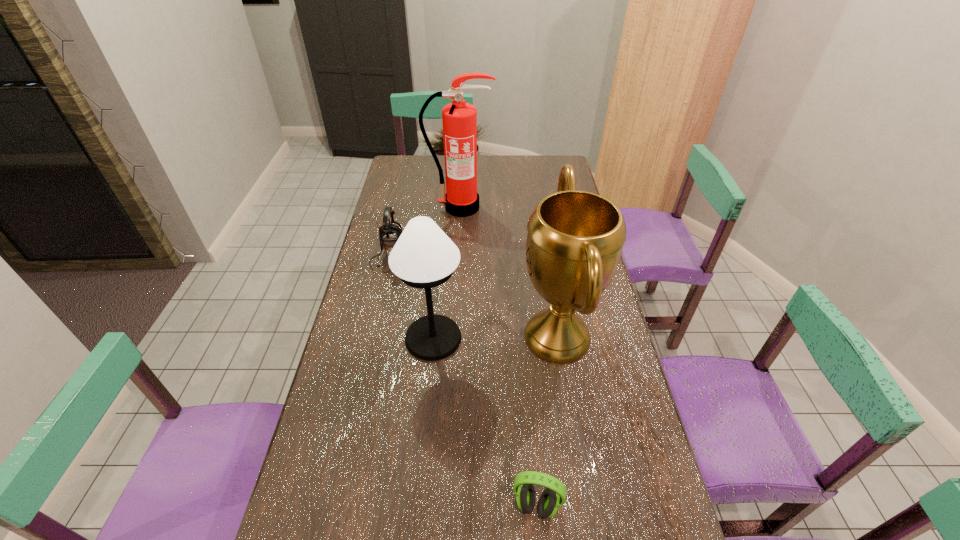
I want to click on free region at the far right corner, so click(552, 156).

At what (x,y) coordinates should I click in order to perform the action: click on vacant point located between the nearest object and the trophy cup. Please return your answer as a coordinate pair (x, y). Looking at the image, I should click on (546, 421).

At what (x,y) coordinates should I click in order to perform the action: click on free space between the fire extinguisher and the headset. Please return your answer as a coordinate pair (x, y). Image resolution: width=960 pixels, height=540 pixels. Looking at the image, I should click on (498, 356).

Locate an element on the screen. The height and width of the screenshot is (540, 960). free space between the trophy cup and the headset is located at coordinates (546, 421).

Locate an element on the screen. empty location between the table lamp and the nearest object is located at coordinates (485, 422).

Where is `empty space between the second farthest object and the headset`? empty space between the second farthest object and the headset is located at coordinates [x=464, y=383].

Image resolution: width=960 pixels, height=540 pixels. Find the location of `free area in between the table lamp and the fourth nearest object`. free area in between the table lamp and the fourth nearest object is located at coordinates (412, 299).

Where is `unoccupied area between the earphone and the table lamp`? The image size is (960, 540). unoccupied area between the earphone and the table lamp is located at coordinates (412, 299).

At what (x,y) coordinates should I click in order to perform the action: click on the closest object to the table lamp. Please return your answer as a coordinate pair (x, y). Image resolution: width=960 pixels, height=540 pixels. Looking at the image, I should click on (575, 239).

Locate which object is the second closest to the trophy cup. Please provide its 2D coordinates. Your answer should be formatted as a tuple, i.e. [(x, y)], where the tuple contains the x and y coordinates of a point satisfying the conditions above.

[(549, 502)]